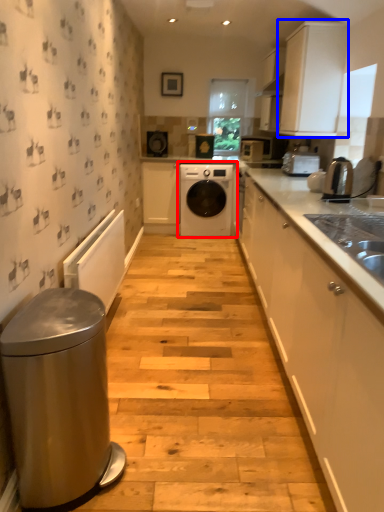
Question: Among these objects, which one is nearest to the camera, washing machine (highlighted by a red box) or cabinetry (highlighted by a blue box)?

Choices:
 (A) washing machine
 (B) cabinetry

Answer: (B)